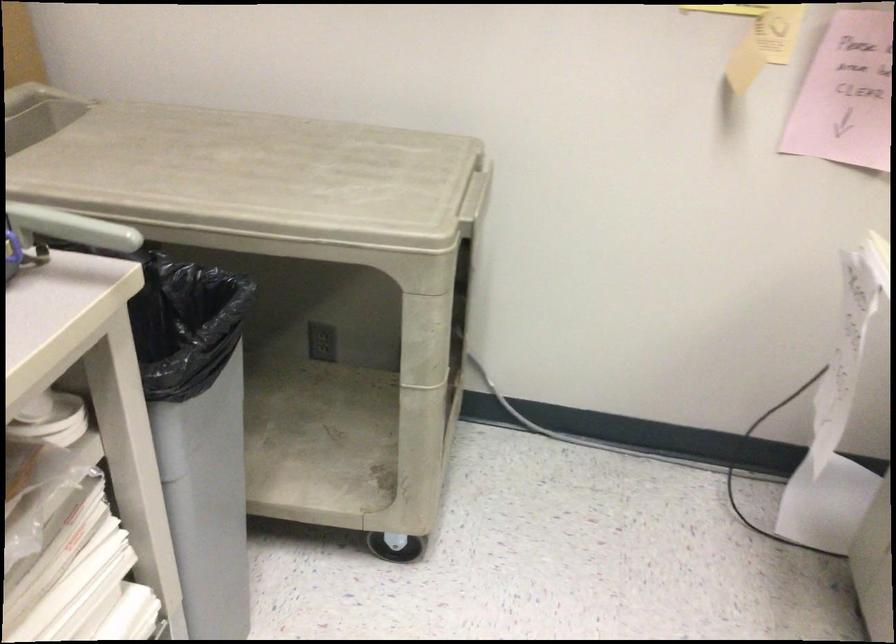
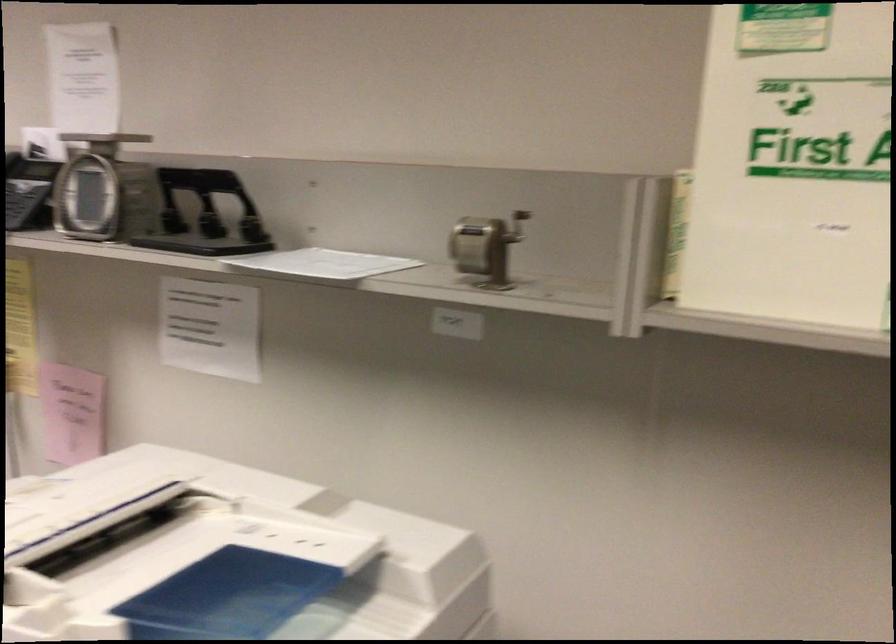
The first image is from the beginning of the video and the second image is from the end. How did the camera likely rotate when shooting the video?

The camera rotated toward right-down.